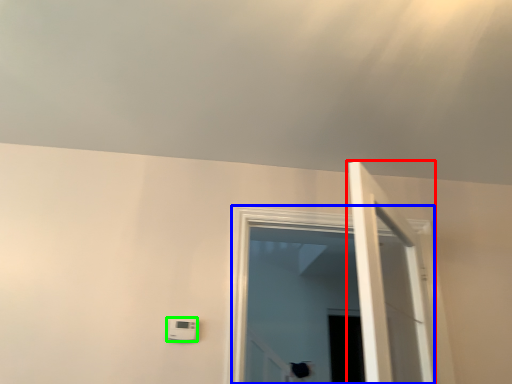
Question: Which object is the farthest from door (highlighted by a red box)? Choose among these: window (highlighted by a blue box) or light switch (highlighted by a green box).

Choices:
 (A) window
 (B) light switch

Answer: (B)